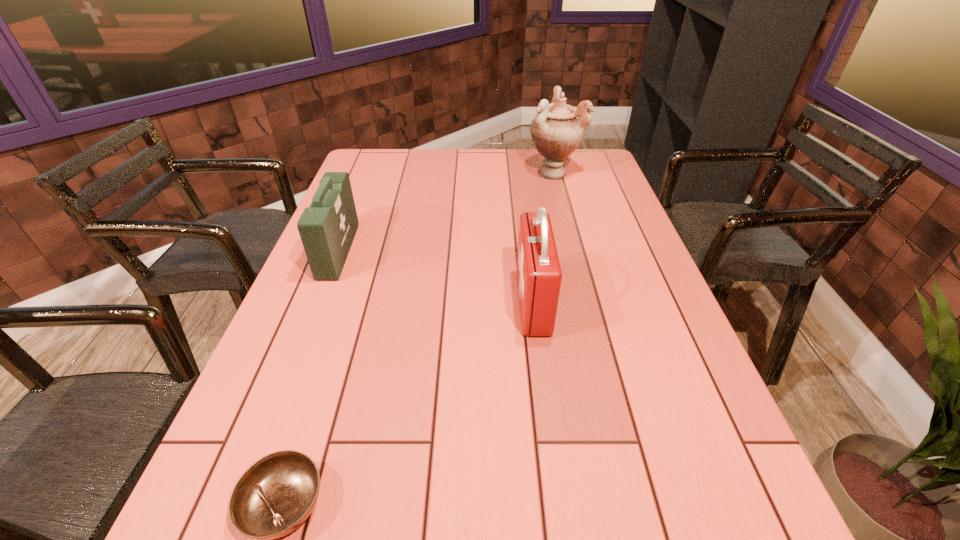
You are a GUI agent. You are given a task and a screenshot of the screen. Output one action in this format:
    pyautogui.click(x=<x>, y=<y>)
    Task: Click on the unoccupied area between the shorter first-aid kit and the farthest object
    Image resolution: width=960 pixels, height=540 pixels.
    Given the screenshot: What is the action you would take?
    pyautogui.click(x=445, y=212)

Locate an element on the screen. The height and width of the screenshot is (540, 960). free space that is in between the taller first-aid kit and the second shortest object is located at coordinates (436, 277).

The image size is (960, 540). I want to click on vacant area that lies between the third object from left to right and the left first-aid kit, so click(436, 277).

Identify the location of unoccupied position between the second shortest object and the second object from right to left. (436, 277).

Where is `free space between the left first-aid kit and the farthest object`? The width and height of the screenshot is (960, 540). free space between the left first-aid kit and the farthest object is located at coordinates tap(445, 212).

You are a GUI agent. You are given a task and a screenshot of the screen. Output one action in this format:
    pyautogui.click(x=<x>, y=<y>)
    Task: Click on the object that is the second nearest to the rightmost object
    The width and height of the screenshot is (960, 540).
    Given the screenshot: What is the action you would take?
    pyautogui.click(x=327, y=228)

Image resolution: width=960 pixels, height=540 pixels. In order to click on object that is the second closest to the second shortest object in this screenshot , I will do `click(274, 496)`.

You are a GUI agent. You are given a task and a screenshot of the screen. Output one action in this format:
    pyautogui.click(x=<x>, y=<y>)
    Task: Click on the vacant point that satisfies the following two spatial constraints: 1. on the front side of the rightmost object; 2. on the front-facing side of the second shortest object
    
    Given the screenshot: What is the action you would take?
    pyautogui.click(x=574, y=251)

The image size is (960, 540). I want to click on free space that satisfies the following two spatial constraints: 1. on the front side of the farthest object; 2. on the front face of the taller first-aid kit, so (x=588, y=302).

Locate an element on the screen. vacant area that satisfies the following two spatial constraints: 1. on the front side of the farthest object; 2. on the front face of the third object from left to right is located at coordinates (588, 302).